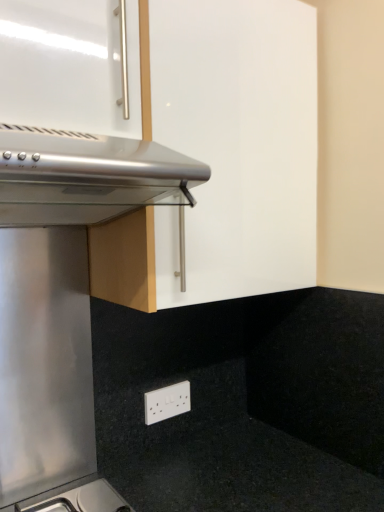
Question: Considering their positions, is white plastic electric outlet at lower center located in front of or behind matte white cabinet at upper center?

Choices:
 (A) front
 (B) behind

Answer: (B)

Question: Based on their positions, is white plastic electric outlet at lower center located to the left or right of matte white cabinet at upper center?

Choices:
 (A) left
 (B) right

Answer: (B)

Question: Which of these objects is positioned closest to the satin silver oven at upper left?

Choices:
 (A) matte white cabinet at upper center
 (B) white plastic electric outlet at lower center

Answer: (A)

Question: Estimate the real-world distances between objects in this image. Which object is closer to the white plastic electric outlet at lower center?

Choices:
 (A) satin silver oven at upper left
 (B) matte white cabinet at upper center

Answer: (B)